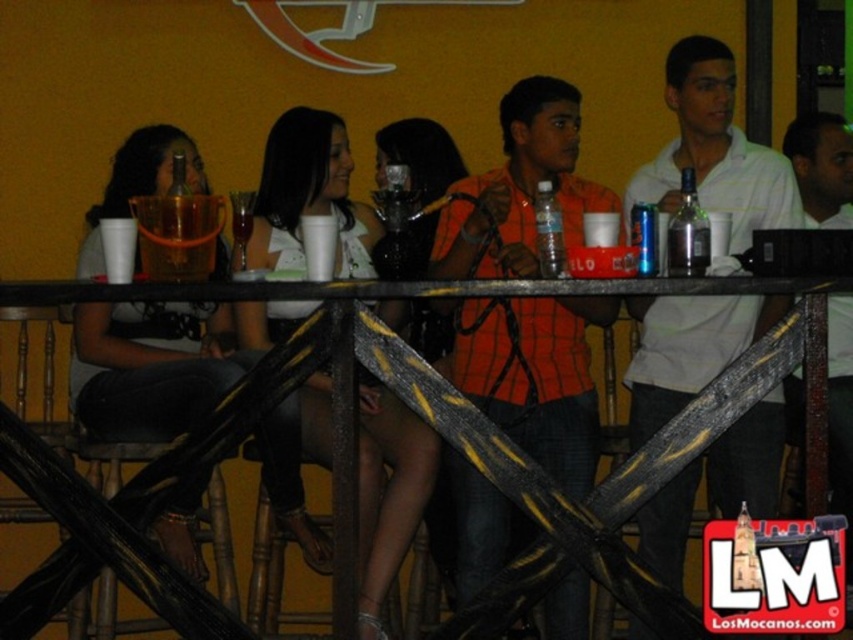
Which is behind, point (660, 369) or point (373, 433)?

The point (373, 433) is behind.

Where is `white cotton shirt at upper right`? white cotton shirt at upper right is located at coordinates (715, 148).

Does clear glass bottle at upper right appear under clear plastic bottle at center?

Correct, clear glass bottle at upper right is located below clear plastic bottle at center.

Between point (693, 227) and point (547, 230), which one is positioned in front?

Point (693, 227) is more forward.

Where is `clear glass bottle at upper right`? clear glass bottle at upper right is located at coordinates (688, 232).

Is point (811, 301) closer to camera compared to point (460, 184)?

Yes, it is in front of point (460, 184).

The height and width of the screenshot is (640, 853). I want to click on black metal table at center, so click(440, 435).

Find the location of a particular element. black metal table at center is located at coordinates (440, 435).

This screenshot has width=853, height=640. Identify the location of black metal table at center. (440, 435).